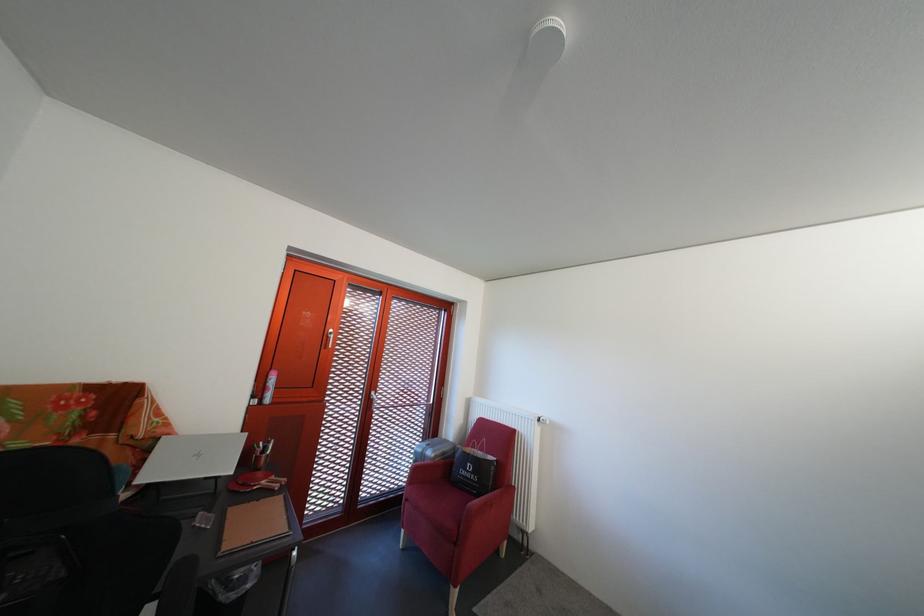
Find where to turn the radiator valve. Please return your answer as a coordinate pair (x, y).

(546, 432)